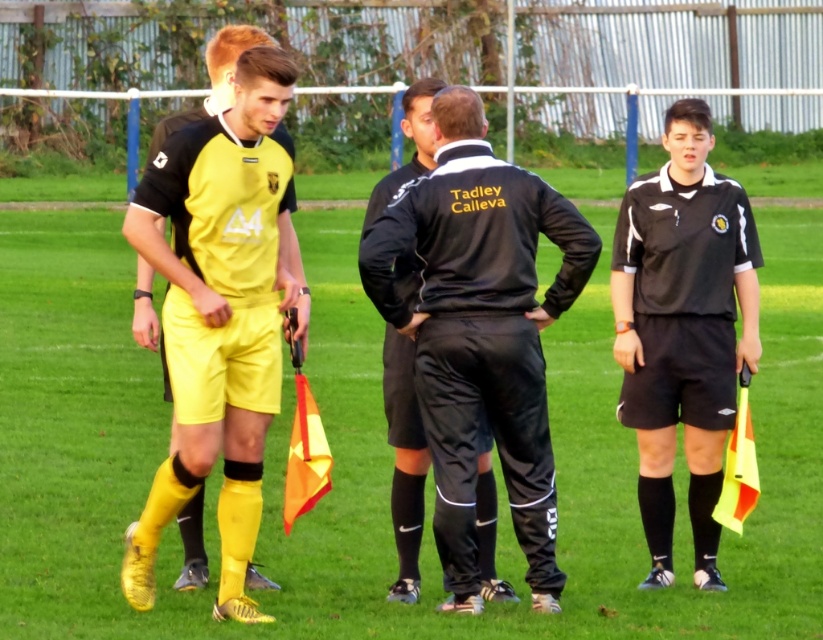
You are a spectator at the soccer match and want to know which of the two people, the one wearing the yellow matte shorts at left or the one in the black matte referee uniform at right, is closer to the camera. Based on their sizes in the image, can you determine this?

The yellow matte shorts at left is larger in size than the black matte referee uniform at right, so the person wearing the yellow matte shorts at left is closer to the camera.